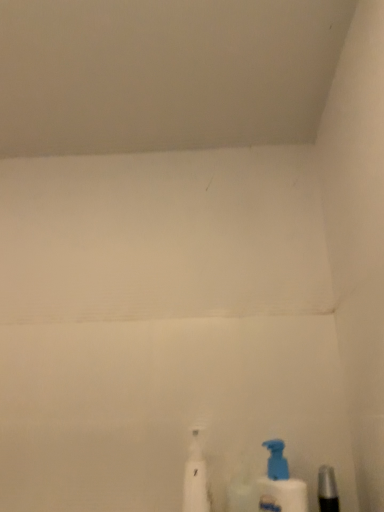
Where is `blue plastic bottle at lower right`? This screenshot has height=512, width=384. blue plastic bottle at lower right is located at coordinates (280, 484).

Where is `blue plastic bottle at lower right`? blue plastic bottle at lower right is located at coordinates (280, 484).

Is point (319, 471) positioned behind point (276, 482)?

Yes, it is behind point (276, 482).

Based on the photo, is metallic silver razor at lower right behind blue plastic bottle at lower right?

No, it is not.

Between metallic silver razor at lower right and blue plastic bottle at lower right, which one has larger size?

blue plastic bottle at lower right is bigger.

Which of these two, metallic silver razor at lower right or blue plastic bottle at lower right, stands taller?

Standing taller between the two is blue plastic bottle at lower right.

Which object is thinner, blue plastic bottle at lower right or metallic silver razor at lower right?

Thinner between the two is metallic silver razor at lower right.

Which is behind, blue plastic bottle at lower right or metallic silver razor at lower right?

blue plastic bottle at lower right is behind.

Is point (264, 481) closer to viewer compared to point (324, 479)?

No, it is not.

Could you tell me if blue plastic bottle at lower right is facing white plastic spray bottle at lower center?

No, blue plastic bottle at lower right is not oriented towards white plastic spray bottle at lower center.

Considering the sizes of objects blue plastic bottle at lower right and white plastic spray bottle at lower center in the image provided, who is wider, blue plastic bottle at lower right or white plastic spray bottle at lower center?

Wider between the two is white plastic spray bottle at lower center.

In the image, is blue plastic bottle at lower right positioned in front of or behind white plastic spray bottle at lower center?

blue plastic bottle at lower right is in front of white plastic spray bottle at lower center.

Is the surface of white plastic spray bottle at lower center in direct contact with blue plastic bottle at lower right?

No, white plastic spray bottle at lower center is not making contact with blue plastic bottle at lower right.

This screenshot has height=512, width=384. What are the coordinates of `bottle below the white plastic spray bottle at lower center (from a real-world perspective)` in the screenshot? It's located at (280, 484).

Is white plastic spray bottle at lower center bigger than blue plastic bottle at lower right?

Yes, white plastic spray bottle at lower center is bigger than blue plastic bottle at lower right.

Is white plastic spray bottle at lower center surrounding blue plastic bottle at lower right?

Definitely not — blue plastic bottle at lower right is not inside white plastic spray bottle at lower center.

From the image's perspective, is metallic silver razor at lower right located beneath white plastic spray bottle at lower center?

Yes.

Looking at their sizes, would you say metallic silver razor at lower right is wider or thinner than white plastic spray bottle at lower center?

metallic silver razor at lower right is thinner than white plastic spray bottle at lower center.

Looking at this image, which of these two, metallic silver razor at lower right or white plastic spray bottle at lower center, stands taller?

Standing taller between the two is white plastic spray bottle at lower center.

Which of these two, metallic silver razor at lower right or white plastic spray bottle at lower center, is bigger?

white plastic spray bottle at lower center.

Which object is closer to the camera, white plastic spray bottle at lower center or metallic silver razor at lower right?

metallic silver razor at lower right is more forward.

Looking at this image, from a real-world perspective, who is located lower, white plastic spray bottle at lower center or metallic silver razor at lower right?

metallic silver razor at lower right, from a real-world perspective.

Does point (192, 451) come behind point (325, 502)?

Yes, point (192, 451) is farther from viewer.

Does white plastic spray bottle at lower center appear on the right side of metallic silver razor at lower right?

Incorrect, white plastic spray bottle at lower center is not on the right side of metallic silver razor at lower right.

Locate an element on the screen. Image resolution: width=384 pixels, height=512 pixels. toiletry located below the blue plastic bottle at lower right (from the image's perspective) is located at coordinates (327, 490).

The image size is (384, 512). I want to click on bottle on the left of metallic silver razor at lower right, so pos(280,484).

From the image, which object appears to be nearer to blue plastic bottle at lower right, metallic silver razor at lower right or white plastic spray bottle at lower center?

metallic silver razor at lower right is positioned closer to the anchor blue plastic bottle at lower right.

Based on their spatial positions, is white plastic spray bottle at lower center or blue plastic bottle at lower right further from metallic silver razor at lower right?

white plastic spray bottle at lower center is further to metallic silver razor at lower right.

Based on the photo, considering their positions, is blue plastic bottle at lower right positioned further to white plastic spray bottle at lower center than metallic silver razor at lower right?

metallic silver razor at lower right.

Looking at the image, which one is located further to blue plastic bottle at lower right, white plastic spray bottle at lower center or metallic silver razor at lower right?

Among the two, white plastic spray bottle at lower center is located further to blue plastic bottle at lower right.

When comparing their distances from metallic silver razor at lower right, does blue plastic bottle at lower right or white plastic spray bottle at lower center seem further?

Based on the image, white plastic spray bottle at lower center appears to be further to metallic silver razor at lower right.

Estimate the real-world distances between objects in this image. Which object is further from white plastic spray bottle at lower center, metallic silver razor at lower right or blue plastic bottle at lower right?

Based on the image, metallic silver razor at lower right appears to be further to white plastic spray bottle at lower center.

This screenshot has width=384, height=512. I want to click on bottle between white plastic spray bottle at lower center and metallic silver razor at lower right from left to right, so click(280, 484).